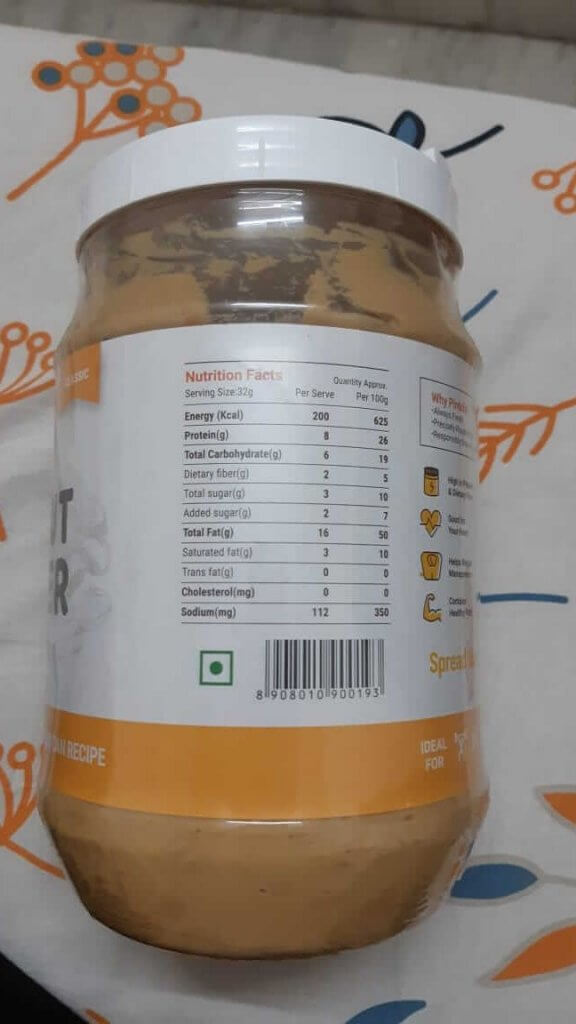
Find the location of a particular element. The height and width of the screenshot is (1024, 576). table cloth is located at coordinates (540, 839).